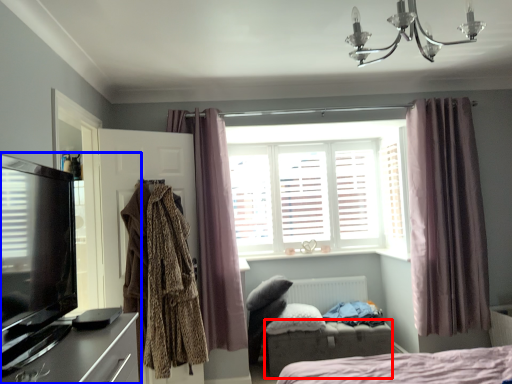
Question: Which object is further to the camera taking this photo, furniture (highlighted by a red box) or entertainment center (highlighted by a blue box)?

Choices:
 (A) furniture
 (B) entertainment center

Answer: (A)